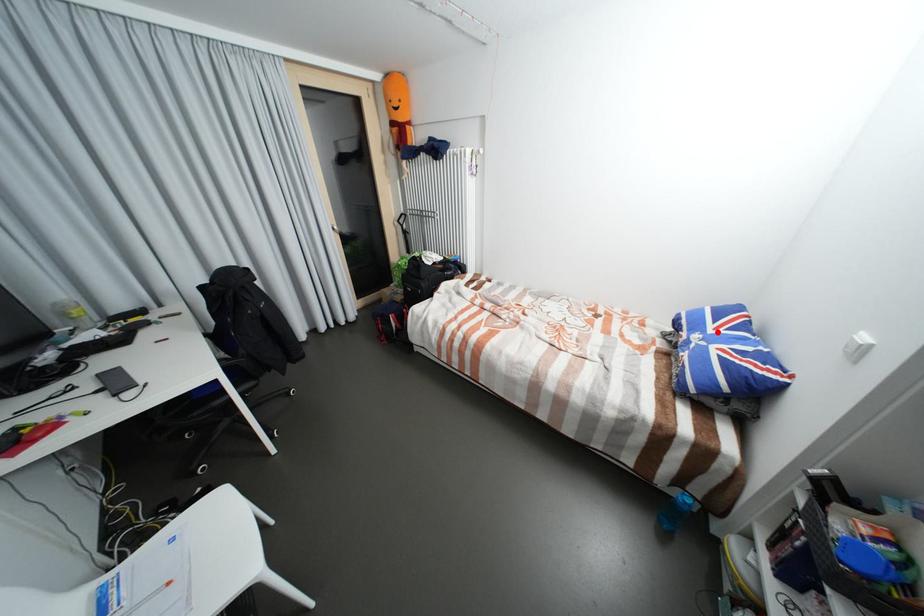
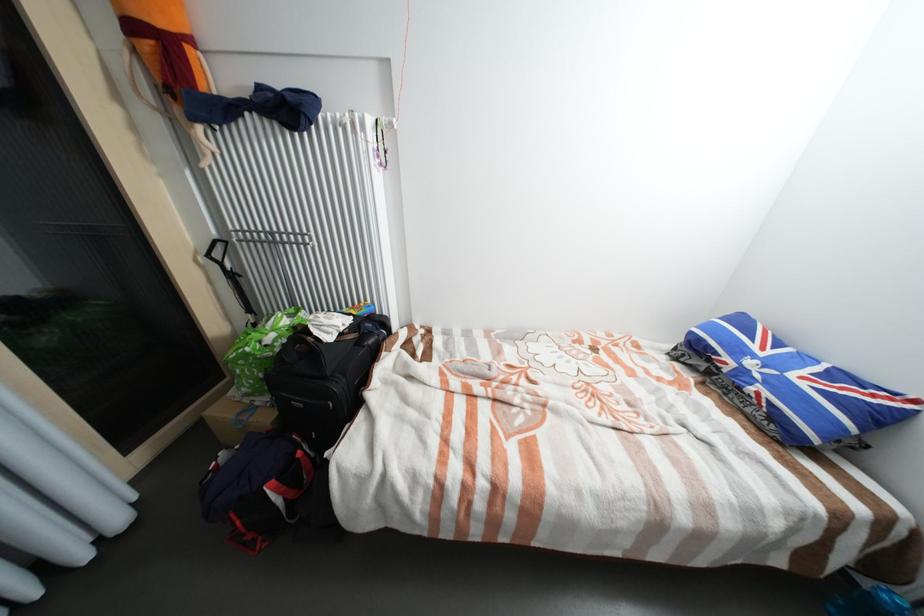
The point at the highlighted location is marked in the first image. Where is the corresponding point in the second image?

(769, 354)